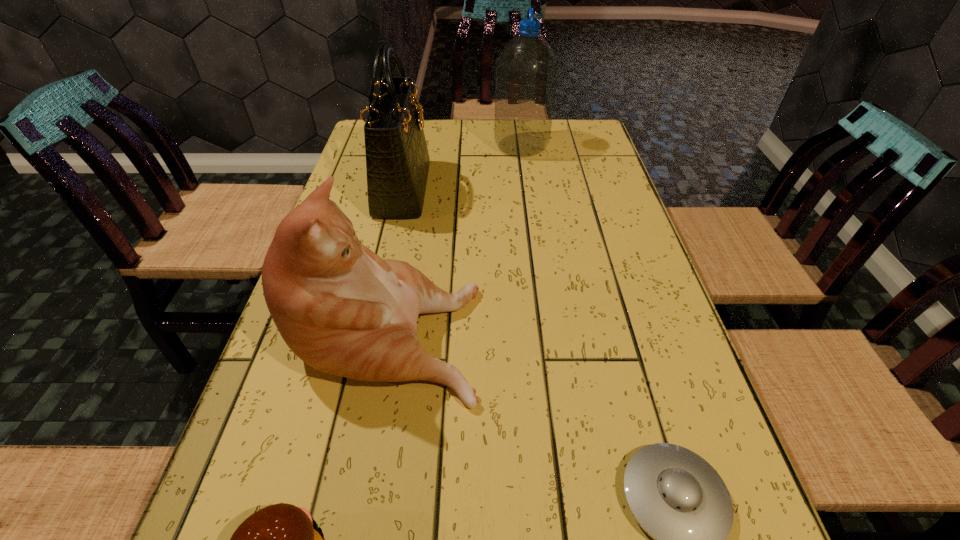
Identify the location of vacant space at the left edge of the desktop. The width and height of the screenshot is (960, 540). (359, 212).

Locate an element on the screen. free space at the right edge of the desktop is located at coordinates (600, 335).

This screenshot has width=960, height=540. I want to click on vacant space that's between the water jug and the handbag, so click(462, 167).

This screenshot has width=960, height=540. What are the coordinates of `free space between the water jug and the handbag` in the screenshot? It's located at (462, 167).

Select which object appears as the second closest to the handbag. Please provide its 2D coordinates. Your answer should be formatted as a tuple, i.e. [(x, y)], where the tuple contains the x and y coordinates of a point satisfying the conditions above.

[(526, 69)]

This screenshot has width=960, height=540. Identify the location of the second closest object to the third farthest object. (282, 539).

I want to click on free space that satisfies the following two spatial constraints: 1. on the front side of the water jug; 2. on the face of the third nearest object, so click(x=545, y=329).

The height and width of the screenshot is (540, 960). Find the location of `vacant space that satisfies the following two spatial constraints: 1. on the front side of the water jug; 2. on the face of the third farthest object`. vacant space that satisfies the following two spatial constraints: 1. on the front side of the water jug; 2. on the face of the third farthest object is located at coordinates click(x=545, y=329).